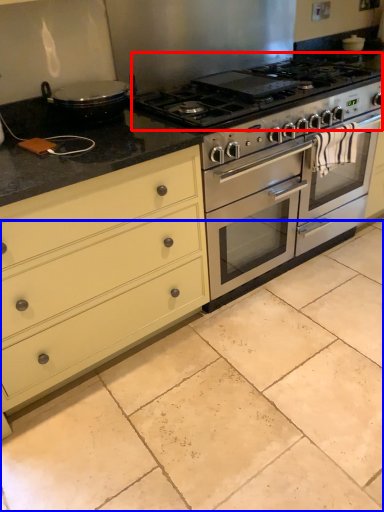
Question: Among these objects, which one is nearest to the camera, gas stove (highlighted by a red box) or ceramic tile (highlighted by a blue box)?

Choices:
 (A) gas stove
 (B) ceramic tile

Answer: (B)